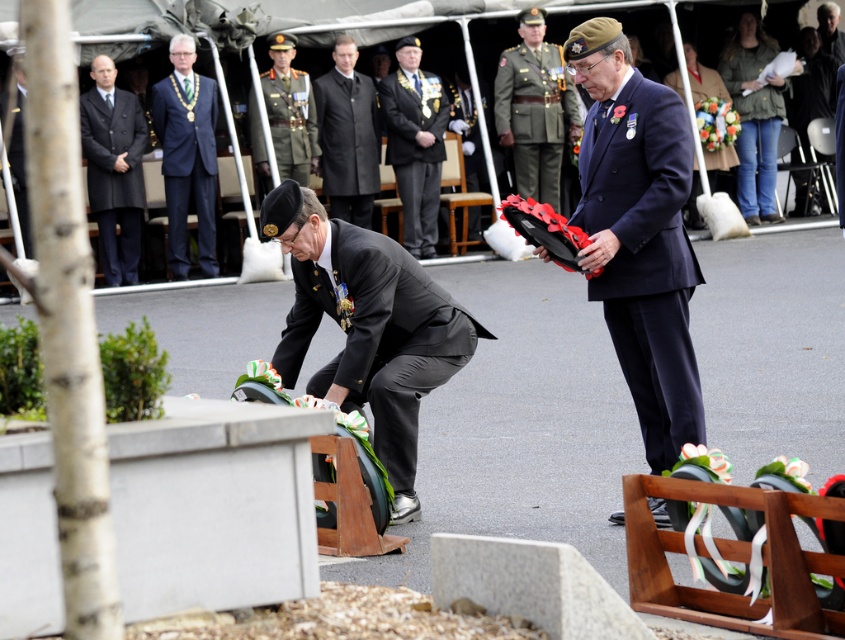
You are a photographer at the ceremony. You need to capture a photo where both the blue fabric suit at upper center and the black wool suit at left are visible. Based on their positions, which one will appear higher in the photo?

The blue fabric suit at upper center will appear higher in the photo because it is positioned above the black wool suit at left.